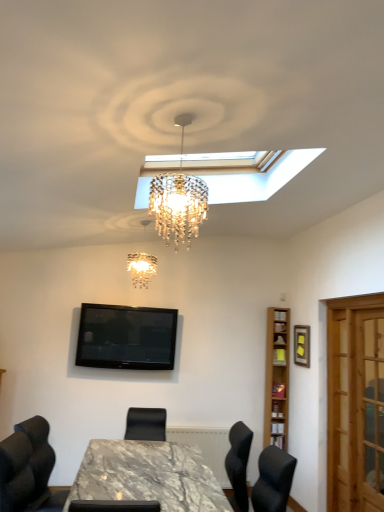
Question: Is crystal chandelier at center oriented away from light brown wooden bookshelf at right?

Choices:
 (A) no
 (B) yes

Answer: (A)

Question: Is the depth of crystal chandelier at center less than that of light brown wooden bookshelf at right?

Choices:
 (A) no
 (B) yes

Answer: (B)

Question: Can you confirm if crystal chandelier at center is thinner than light brown wooden bookshelf at right?

Choices:
 (A) yes
 (B) no

Answer: (B)

Question: From the image's perspective, is crystal chandelier at center beneath light brown wooden bookshelf at right?

Choices:
 (A) yes
 (B) no

Answer: (B)

Question: Are crystal chandelier at center and light brown wooden bookshelf at right making contact?

Choices:
 (A) yes
 (B) no

Answer: (B)

Question: From the image's perspective, is crystal chandelier at center on top of light brown wooden bookshelf at right?

Choices:
 (A) yes
 (B) no

Answer: (A)

Question: Does crystal chandelier at center have a greater width compared to wooden screen door at right?

Choices:
 (A) no
 (B) yes

Answer: (B)

Question: Considering the relative sizes of crystal chandelier at center and wooden screen door at right in the image provided, is crystal chandelier at center thinner than wooden screen door at right?

Choices:
 (A) no
 (B) yes

Answer: (A)

Question: Considering the relative positions of crystal chandelier at center and wooden screen door at right in the image provided, is crystal chandelier at center to the right of wooden screen door at right from the viewer's perspective?

Choices:
 (A) yes
 (B) no

Answer: (B)

Question: Is crystal chandelier at center oriented towards wooden screen door at right?

Choices:
 (A) yes
 (B) no

Answer: (B)

Question: Is crystal chandelier at center outside wooden screen door at right?

Choices:
 (A) yes
 (B) no

Answer: (A)

Question: Is crystal chandelier at center turned away from wooden screen door at right?

Choices:
 (A) no
 (B) yes

Answer: (A)

Question: Is wooden picture frame at upper right at the left side of light brown wooden bookshelf at right?

Choices:
 (A) yes
 (B) no

Answer: (B)